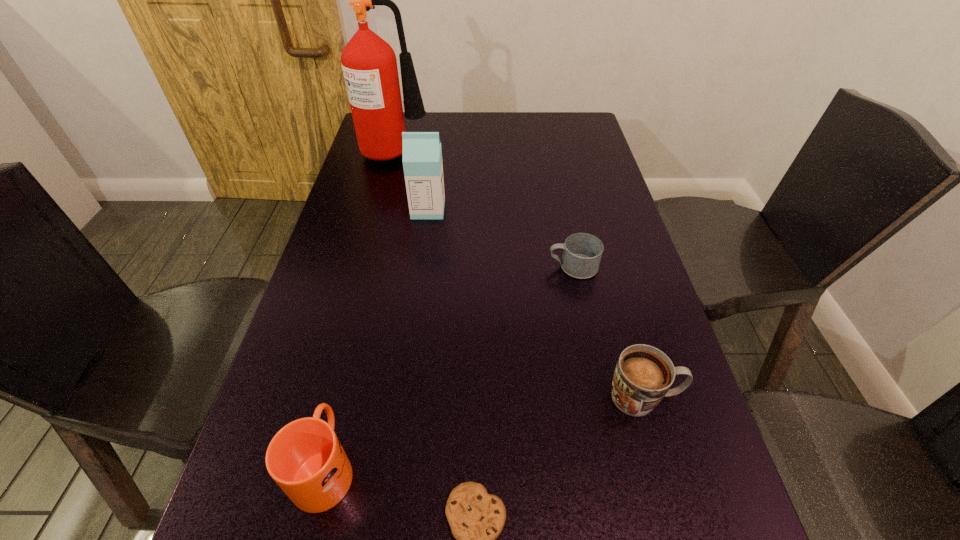
Image resolution: width=960 pixels, height=540 pixels. What are the coordinates of `free space that satisfies the following two spatial constraints: 1. on the handle side of the leftmost mug; 2. on the left side of the fifth shortest object` in the screenshot? It's located at (387, 210).

At what (x,y) coordinates should I click in order to perform the action: click on free spot that satisfies the following two spatial constraints: 1. at the nozzle of the tallest object; 2. on the right side of the milk carton. Please return your answer as a coordinate pair (x, y). Looking at the image, I should click on (382, 210).

You are a GUI agent. You are given a task and a screenshot of the screen. Output one action in this format:
    pyautogui.click(x=<x>, y=<y>)
    Task: Click on the vacant space that satisfies the following two spatial constraints: 1. at the nozzle of the tallest object; 2. on the left side of the second tallest object
    This screenshot has width=960, height=540.
    Given the screenshot: What is the action you would take?
    tap(382, 210)